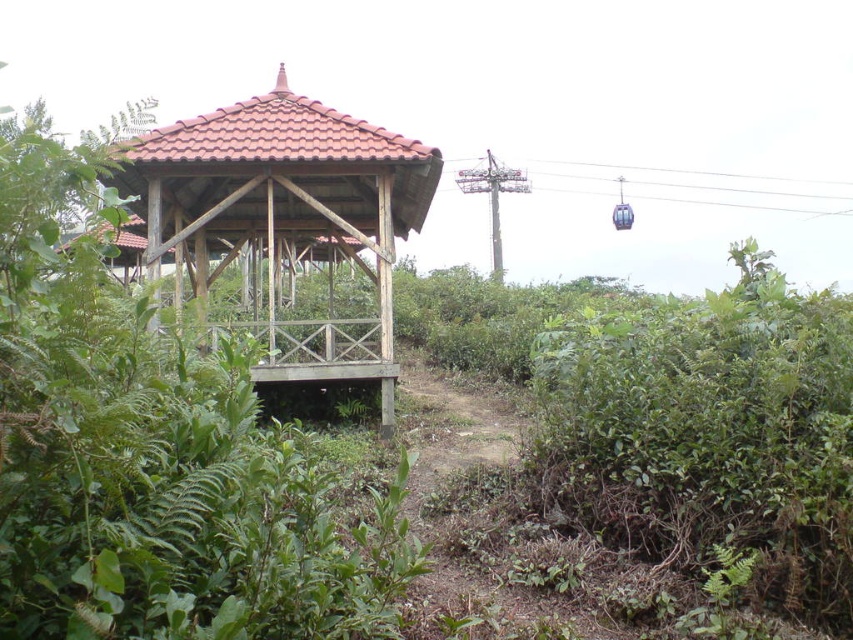
Question: Which point is closer to the camera taking this photo?

Choices:
 (A) (664, 557)
 (B) (248, 221)

Answer: (A)

Question: Is green leafy bush at lower right below wooden gazebo at center?

Choices:
 (A) yes
 (B) no

Answer: (A)

Question: Can you confirm if green leafy bush at lower right is thinner than wooden gazebo at center?

Choices:
 (A) no
 (B) yes

Answer: (B)

Question: Does green leafy bush at lower right have a larger size compared to wooden gazebo at center?

Choices:
 (A) yes
 (B) no

Answer: (B)